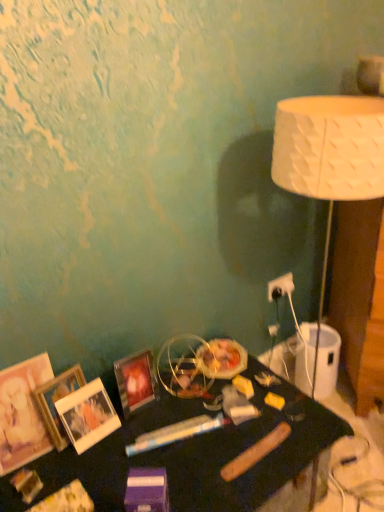
Question: Is white plastic electric outlet at upper right to the right of wooden photo frame at lower left, marked as the 3th picture frame in a right-to-left arrangement, from the viewer's perspective?

Choices:
 (A) no
 (B) yes

Answer: (B)

Question: From a real-world perspective, is white plastic electric outlet at upper right located higher than wooden photo frame at lower left, placed as the second picture frame when sorted from left to right?

Choices:
 (A) no
 (B) yes

Answer: (A)

Question: Would you say white plastic electric outlet at upper right is a long distance from wooden photo frame at lower left, marked as the 3th picture frame in a right-to-left arrangement?

Choices:
 (A) yes
 (B) no

Answer: (B)

Question: Could wooden photo frame at lower left, marked as the 3th picture frame in a right-to-left arrangement, be considered to be inside white plastic electric outlet at upper right?

Choices:
 (A) yes
 (B) no

Answer: (B)

Question: Is white plastic electric outlet at upper right further to the viewer compared to wooden photo frame at lower left, placed as the second picture frame when sorted from left to right?

Choices:
 (A) yes
 (B) no

Answer: (A)

Question: Considering their positions, is white textured lampshade at right located in front of or behind matte glass picture frame at lower left, which is the 4th picture frame in left-to-right order?

Choices:
 (A) behind
 (B) front

Answer: (B)

Question: From a real-world perspective, is white textured lampshade at right positioned above or below matte glass picture frame at lower left, which is the 4th picture frame in left-to-right order?

Choices:
 (A) above
 (B) below

Answer: (A)

Question: Looking at their shapes, would you say white textured lampshade at right is wider or thinner than matte glass picture frame at lower left, which is the 4th picture frame in left-to-right order?

Choices:
 (A) wide
 (B) thin

Answer: (A)

Question: Does point (347, 195) appear closer or farther from the camera than point (130, 375)?

Choices:
 (A) closer
 (B) farther

Answer: (A)

Question: From the image's perspective, relative to wooden photo frame at lower left, marked as the 3th picture frame in a right-to-left arrangement, is white textured lampshade at right above or below?

Choices:
 (A) below
 (B) above

Answer: (B)

Question: Is white textured lampshade at right inside or outside of wooden photo frame at lower left, placed as the second picture frame when sorted from left to right?

Choices:
 (A) inside
 (B) outside

Answer: (B)

Question: Is white textured lampshade at right in front of or behind wooden photo frame at lower left, placed as the second picture frame when sorted from left to right, in the image?

Choices:
 (A) behind
 (B) front

Answer: (A)

Question: Visually, is white textured lampshade at right positioned to the left or to the right of wooden photo frame at lower left, marked as the 3th picture frame in a right-to-left arrangement?

Choices:
 (A) right
 (B) left

Answer: (A)

Question: From the image's perspective, is white plastic electric outlet at upper right positioned above or below white matte picture frame at lower left, which is the 2th picture frame in right-to-left order?

Choices:
 (A) below
 (B) above

Answer: (B)

Question: Do you think white plastic electric outlet at upper right is within white matte picture frame at lower left, which is the 2th picture frame in right-to-left order, or outside of it?

Choices:
 (A) inside
 (B) outside

Answer: (B)